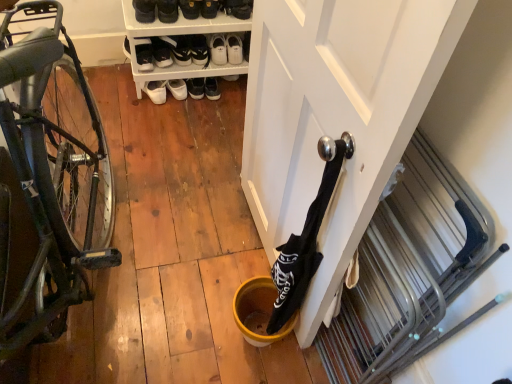
Identify the location of vacant region to the left of white matte door at center. (170, 257).